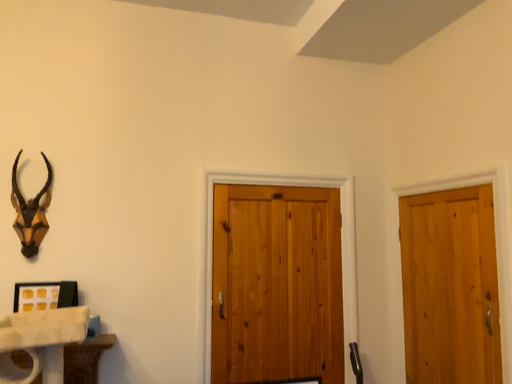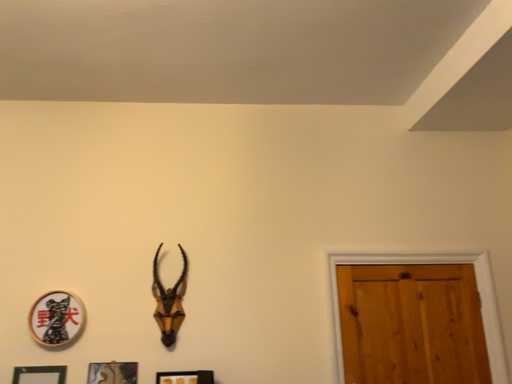
Question: How did the camera likely rotate when shooting the video?

Choices:
 (A) rotated right
 (B) rotated left

Answer: (B)